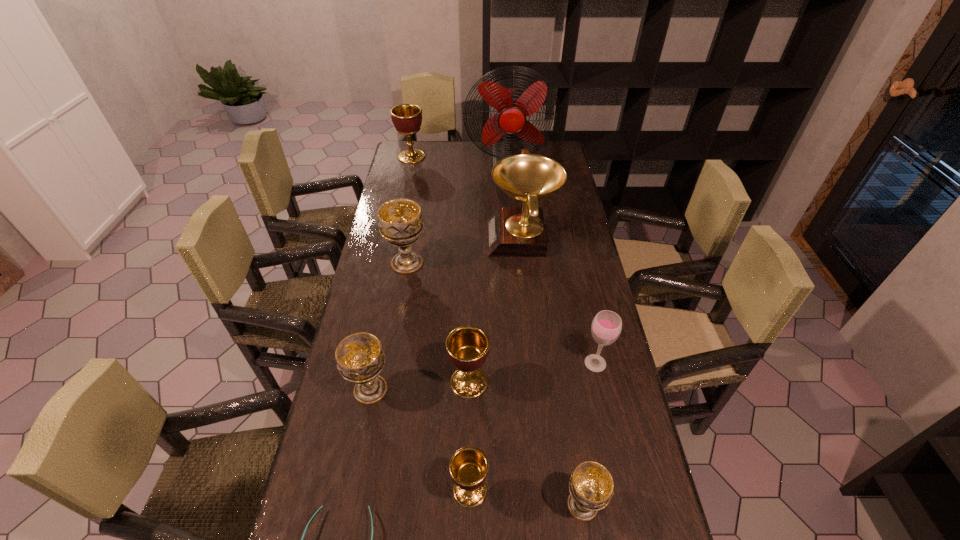
Locate an element on the screen. the rightmost white chalice is located at coordinates click(x=591, y=485).

At what (x,y) coordinates should I click in order to perform the action: click on the nearest white chalice. Please return your answer as a coordinate pair (x, y). This screenshot has width=960, height=540. Looking at the image, I should click on (591, 485).

You are a GUI agent. You are given a task and a screenshot of the screen. Output one action in this format:
    pyautogui.click(x=<x>, y=<y>)
    Task: Click on the blank area located on the front-facing side of the tallest object
    This screenshot has height=540, width=960.
    Given the screenshot: What is the action you would take?
    pyautogui.click(x=514, y=221)

Identify the location of vacant space located on the front-facing side of the ninth shortest object. (449, 239).

This screenshot has width=960, height=540. I want to click on blank space located on the front-facing side of the ninth shortest object, so click(x=401, y=239).

The height and width of the screenshot is (540, 960). What are the coordinates of `free region located on the front-facing side of the ninth shortest object` in the screenshot? It's located at (444, 239).

The image size is (960, 540). Identify the location of vacant area situated on the front of the farthest chalice. (408, 173).

This screenshot has height=540, width=960. In order to click on free spot located on the front of the second farthest chalice in this screenshot , I will do `click(402, 293)`.

Locate an element on the screen. The width and height of the screenshot is (960, 540). vacant space situated 0.100m on the back of the wineglass is located at coordinates (588, 325).

Locate an element on the screen. The width and height of the screenshot is (960, 540). vacant space located 0.250m on the left of the second biggest golden chalice is located at coordinates (358, 382).